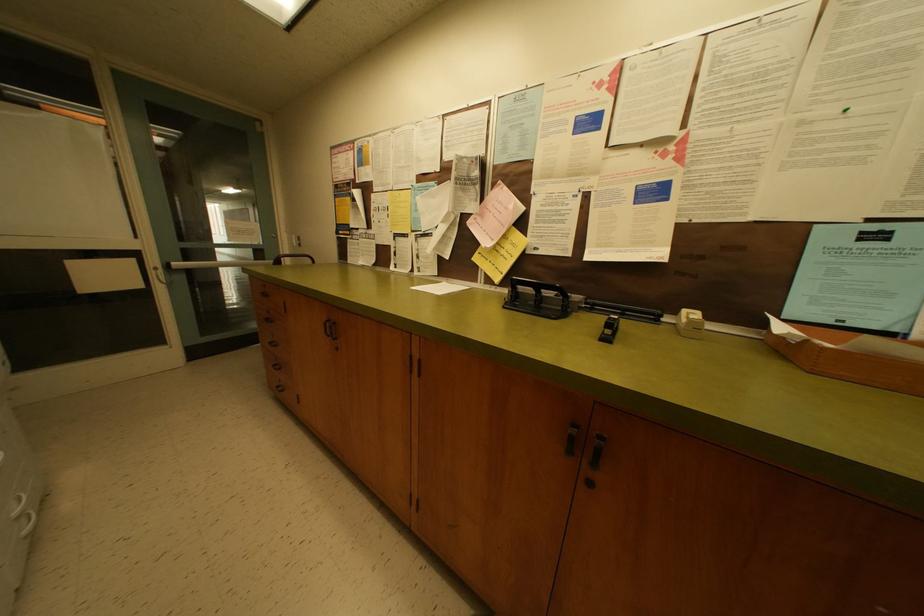
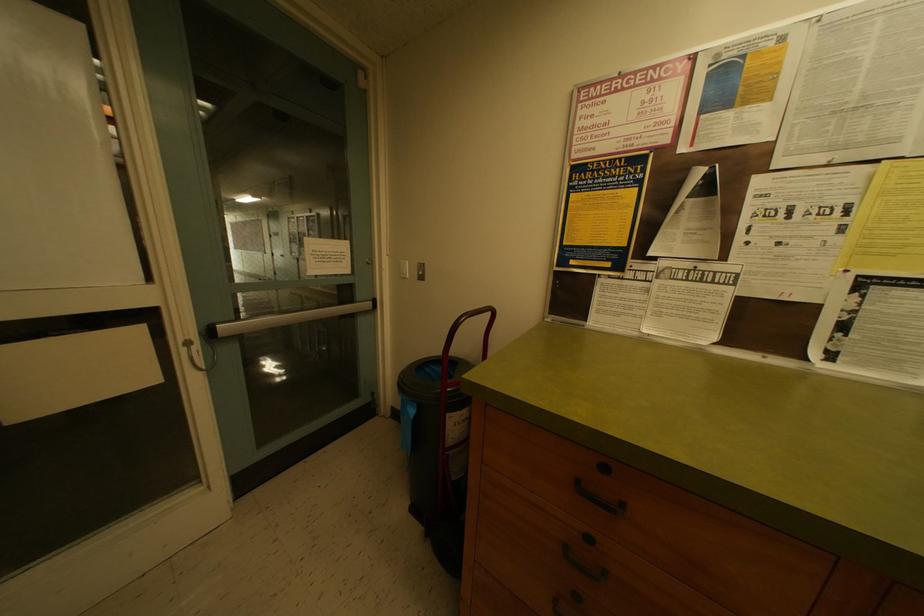
The images are taken continuously from a first-person perspective. In which direction are you moving?

The movement direction of the cameraman is left, forward.